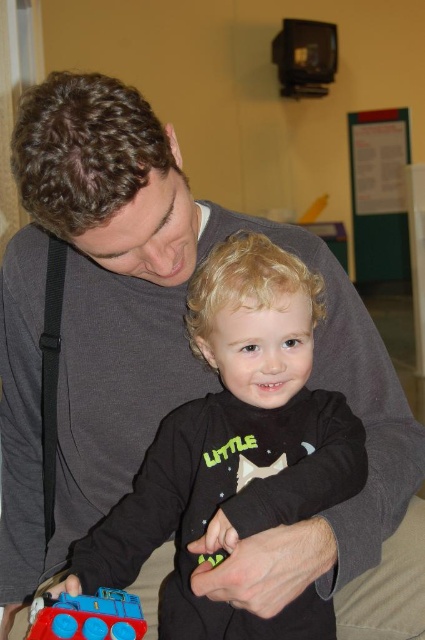
You are taking a photo of two points in the scene. The first point is labeled as point (90, 556) and the second is point (116, 637). Which point is closer to the camera?

Point (90, 556) is closer to the camera than point (116, 637) because it is further to the camera than the other point.

You are an interior designer planning to place a decorative item on a shelf. The shelf has limited space. You have the black matte shirt at center and the rubberized blue train at lower left. Which item should you choose to fit better on the shelf if the shelf can only accommodate one object that is not covered by another?

The rubberized blue train at lower left should be chosen because the black matte shirt at center is positioned over it, indicating that the shirt might be covering part of the train, so the train alone would fit better on the shelf without overlapping.

You are standing in a room and want to take a photo of the point at coordinates [306,438]. The camera you are using has a minimum focus distance of 30 inches. Will the camera be able to focus on that point?

The point at coordinates [306,438] is 32.38 inches from the camera, which is beyond the minimum focus distance of 30 inches. Therefore, the camera should be able to focus on that point.